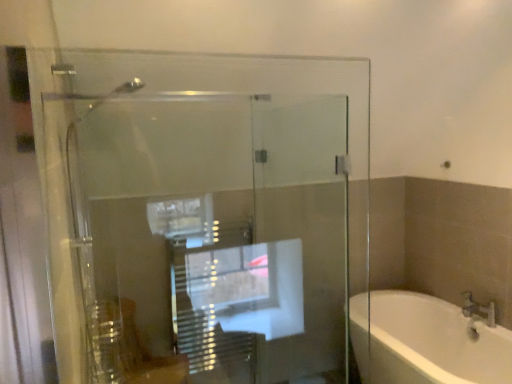
Measure the distance between point (259, 145) and camera.

Point (259, 145) and camera are 8.53 feet apart.

Describe the element at coordinates (221, 233) in the screenshot. I see `transparent glass shower door at center` at that location.

At what (x,y) coordinates should I click in order to perform the action: click on transparent glass shower door at center. Please return your answer as a coordinate pair (x, y). Image resolution: width=512 pixels, height=384 pixels. Looking at the image, I should click on (221, 233).

I want to click on transparent glass shower door at center, so click(x=221, y=233).